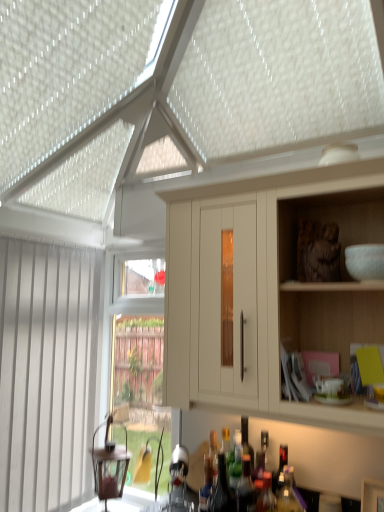
Question: From a real-world perspective, does white vertical blinds at left sit lower than translucent glass bottle at center, positioned as the second bottle in left-to-right order?

Choices:
 (A) yes
 (B) no

Answer: (B)

Question: Can you confirm if white vertical blinds at left is taller than translucent glass bottle at center, marked as the 4th bottle in a right-to-left arrangement?

Choices:
 (A) yes
 (B) no

Answer: (A)

Question: Does white vertical blinds at left appear on the left side of translucent glass bottle at center, marked as the 4th bottle in a right-to-left arrangement?

Choices:
 (A) yes
 (B) no

Answer: (A)

Question: Is white vertical blinds at left to the right of translucent glass bottle at center, marked as the 4th bottle in a right-to-left arrangement, from the viewer's perspective?

Choices:
 (A) yes
 (B) no

Answer: (B)

Question: Is white vertical blinds at left smaller than translucent glass bottle at center, marked as the 4th bottle in a right-to-left arrangement?

Choices:
 (A) yes
 (B) no

Answer: (B)

Question: Relative to translucent glass bottle at lower center, acting as the 4th bottle starting from the left, is translucent glass bottle at center, acting as the 5th bottle starting from the left, in front or behind?

Choices:
 (A) behind
 (B) front

Answer: (A)

Question: Is translucent glass bottle at center, which is counted as the 1th bottle, starting from the right, inside the boundaries of translucent glass bottle at lower center, acting as the 4th bottle starting from the left, or outside?

Choices:
 (A) outside
 (B) inside

Answer: (A)

Question: From their relative heights in the image, would you say translucent glass bottle at center, acting as the 5th bottle starting from the left, is taller or shorter than translucent glass bottle at lower center, acting as the 4th bottle starting from the left?

Choices:
 (A) tall
 (B) short

Answer: (A)

Question: Considering the positions of translucent glass bottle at center, which is counted as the 1th bottle, starting from the right, and translucent glass bottle at lower center, positioned as the second bottle in right-to-left order, in the image, is translucent glass bottle at center, which is counted as the 1th bottle, starting from the right, bigger or smaller than translucent glass bottle at lower center, positioned as the second bottle in right-to-left order,?

Choices:
 (A) small
 (B) big

Answer: (B)

Question: Is matte white cabinet at upper right bigger or smaller than translucent glass bottle at lower center, acting as the first bottle starting from the left?

Choices:
 (A) big
 (B) small

Answer: (A)

Question: From the image's perspective, is matte white cabinet at upper right above or below translucent glass bottle at lower center, acting as the first bottle starting from the left?

Choices:
 (A) above
 (B) below

Answer: (A)

Question: Is matte white cabinet at upper right wider or thinner than translucent glass bottle at lower center, the fifth bottle from the right?

Choices:
 (A) thin
 (B) wide

Answer: (B)

Question: In terms of height, does matte white cabinet at upper right look taller or shorter compared to translucent glass bottle at lower center, acting as the first bottle starting from the left?

Choices:
 (A) tall
 (B) short

Answer: (A)

Question: From a real-world perspective, relative to white vertical blinds at left, is translucent glass bottle at lower center, positioned as the second bottle in right-to-left order, vertically above or below?

Choices:
 (A) below
 (B) above

Answer: (A)

Question: Considering the positions of translucent glass bottle at lower center, acting as the 4th bottle starting from the left, and white vertical blinds at left in the image, is translucent glass bottle at lower center, acting as the 4th bottle starting from the left, wider or thinner than white vertical blinds at left?

Choices:
 (A) thin
 (B) wide

Answer: (B)